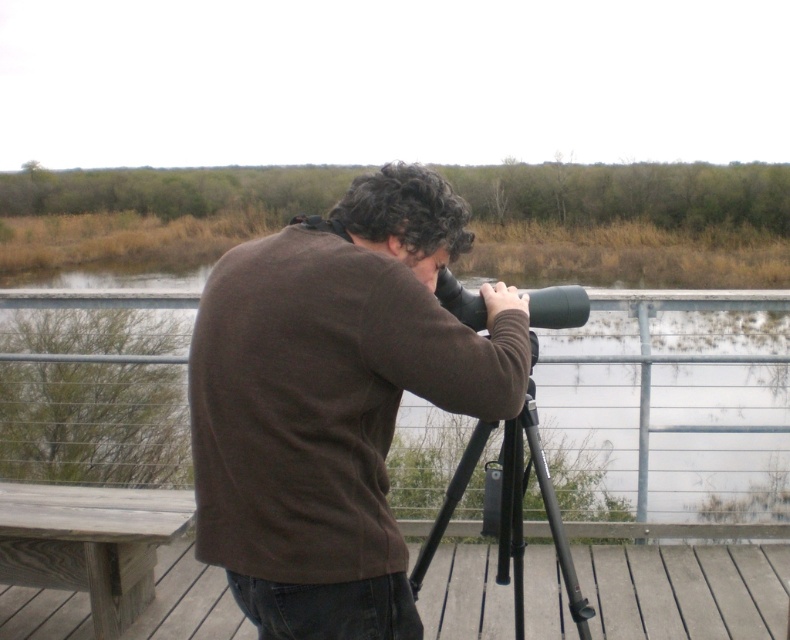
You are a fashion designer observing the scene. You need to determine if the brown matte sweater at center can be paired with the wooden at lower left for a winter collection. Considering their sizes, would the combination be visually balanced?

The brown matte sweater at center has a larger size compared to wooden at lower left. The combination might not be visually balanced due to the significant size difference between the two items.

You are a photographer trying to capture the person using the telescope. You want to ensure the brown matte sweater at center is visible in the photo. Where should you position yourself relative to the point marked at coordinates (333, 401)?

The brown matte sweater at center is located exactly at the point marked at coordinates (333, 401). To ensure it is visible, position yourself directly at or near this point, keeping the sweater within your camera frame.

You are standing on the wooden deck and want to place a small potted plant on the wooden at lower left. According to the coordinates provided, where exactly should you place it?

You should place the small potted plant at the coordinates point (685, 589) where the wooden at lower left is located.